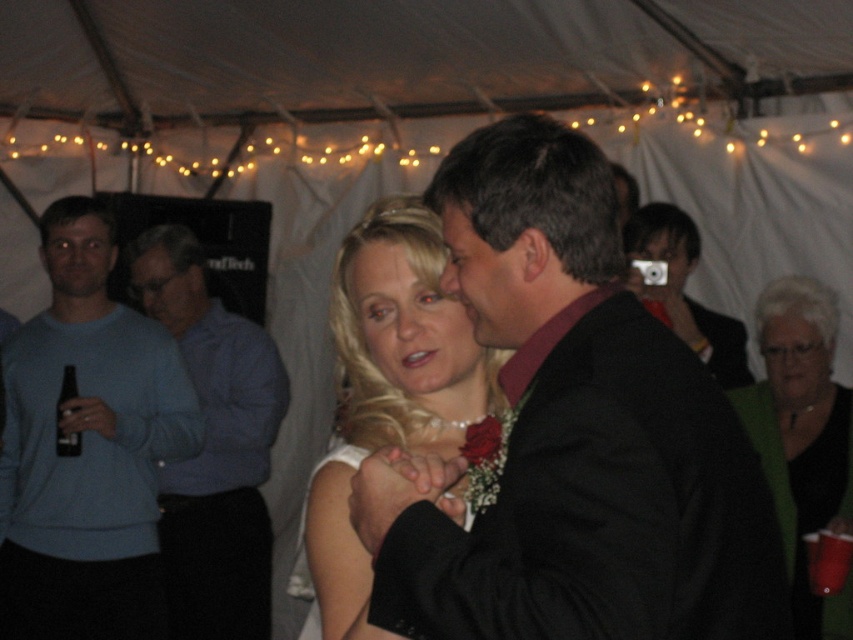
You are standing at the entrance of the tent and want to take a photo of the dancing couple. The photographer told you to focus on the point closer to you between point (375, 534) and point (657, 248). Which point should you focus on?

You should focus on point (375, 534) because it is closer to you than point (657, 248).

You are a photographer at the event and need to capture a closeup shot of the black satin suit at center. The camera you are using has a minimum focusing distance of 38 inches. Will you be able to take the photo without moving closer?

The black satin suit at center and camera are 37.83 inches apart, which is less than the camera minimum focusing distance of 38 inches. Therefore, you cannot take the photo without moving further away or adjusting your position to increase the distance.